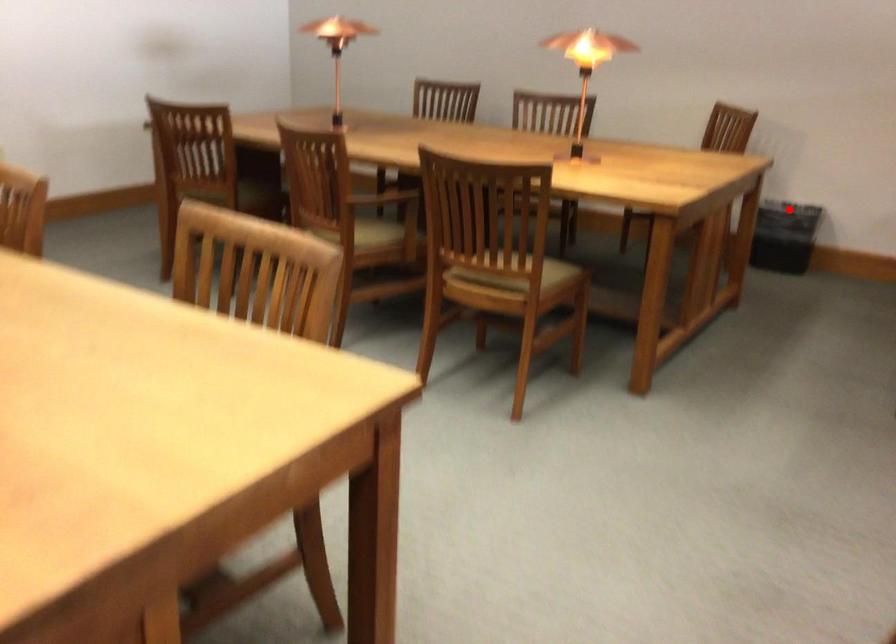
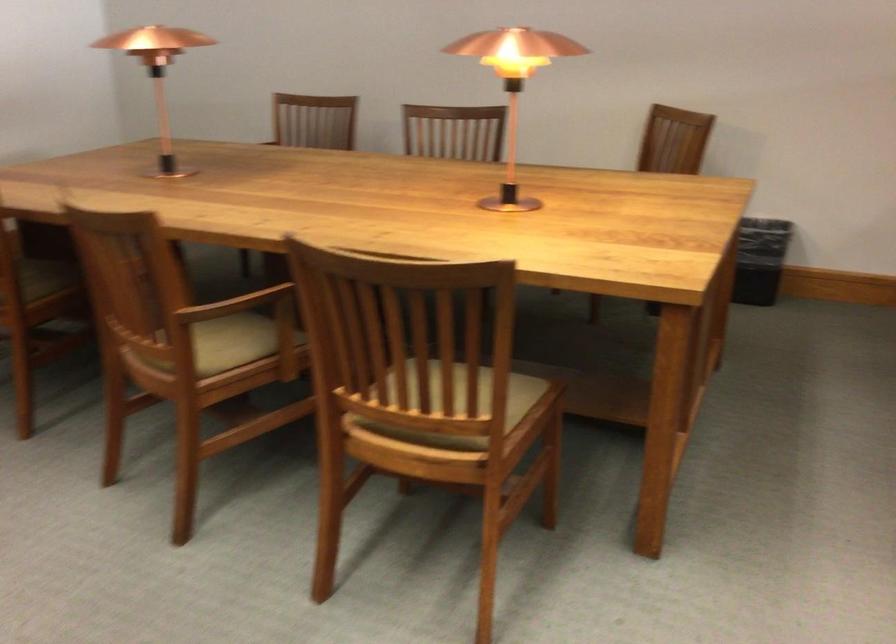
Question: I am providing you with two images of the same scene from different viewpoints. In image1, a red point is highlighted. Considering the same 3D point in image2, which of the following is correct?

Choices:
 (A) It is closer
 (B) It is farther

Answer: (A)